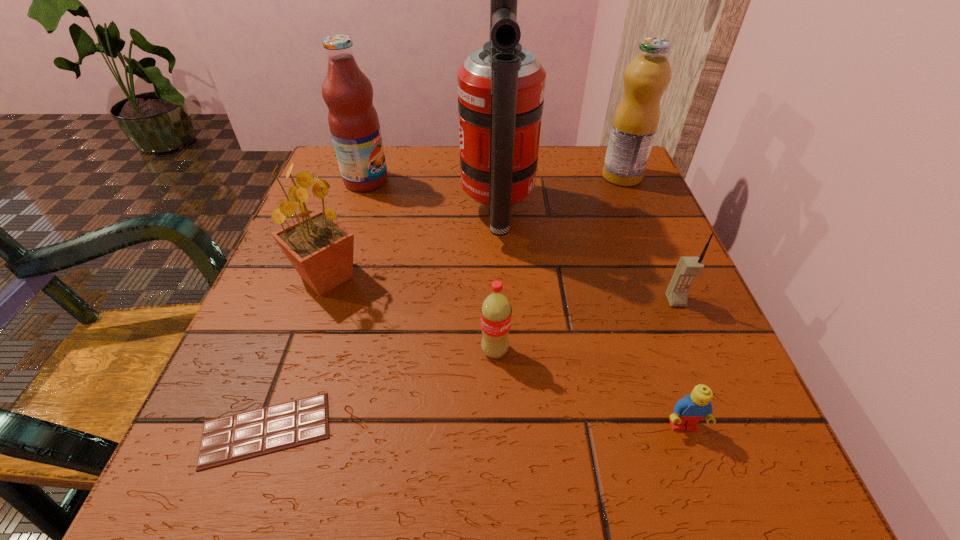
Where is `vacant space in between the chocolate bar and the left fruit juice`? The width and height of the screenshot is (960, 540). vacant space in between the chocolate bar and the left fruit juice is located at coordinates tap(316, 306).

Where is `free space between the cellular telephone and the Lego`? free space between the cellular telephone and the Lego is located at coordinates (680, 363).

Identify the location of empty space that is in between the sixth farthest object and the chocolate bar. This screenshot has width=960, height=540. (380, 390).

In order to click on vacant space that's between the cellular telephone and the left fruit juice in this screenshot , I will do `click(520, 241)`.

Locate an element on the screen. Image resolution: width=960 pixels, height=540 pixels. free spot between the cellular telephone and the left fruit juice is located at coordinates (520, 241).

Find the location of a particular element. This screenshot has width=960, height=540. empty space that is in between the cellular telephone and the fire extinguisher is located at coordinates (587, 256).

Image resolution: width=960 pixels, height=540 pixels. I want to click on vacant area between the soda and the cellular telephone, so click(585, 326).

Locate which object is the fourth closest to the chocolate bar. Please provide its 2D coordinates. Your answer should be formatted as a tuple, i.e. [(x, y)], where the tuple contains the x and y coordinates of a point satisfying the conditions above.

[(688, 411)]

You are a GUI agent. You are given a task and a screenshot of the screen. Output one action in this format:
    pyautogui.click(x=<x>, y=<y>)
    Task: Click on the closest object to the tallest object
    
    Given the screenshot: What is the action you would take?
    (320, 248)

The width and height of the screenshot is (960, 540). Identify the location of free space in the image that satisfies the following two spatial constraints: 1. on the front label of the left fruit juice; 2. on the front side of the shortest object. [284, 430].